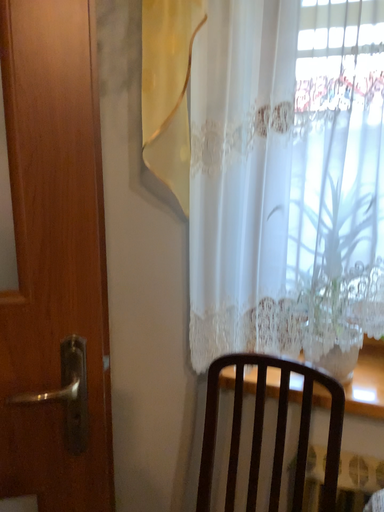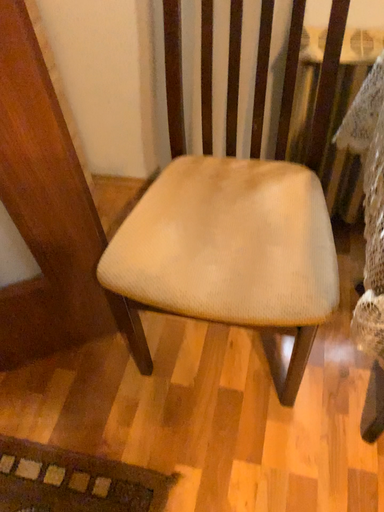
Question: How did the camera likely rotate when shooting the video?

Choices:
 (A) rotated downward
 (B) rotated upward

Answer: (A)